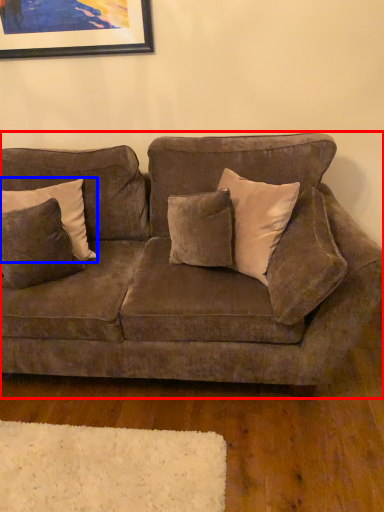
Question: Which object appears farthest to the camera in this image, studio couch (highlighted by a red box) or pillow (highlighted by a blue box)?

Choices:
 (A) studio couch
 (B) pillow

Answer: (B)